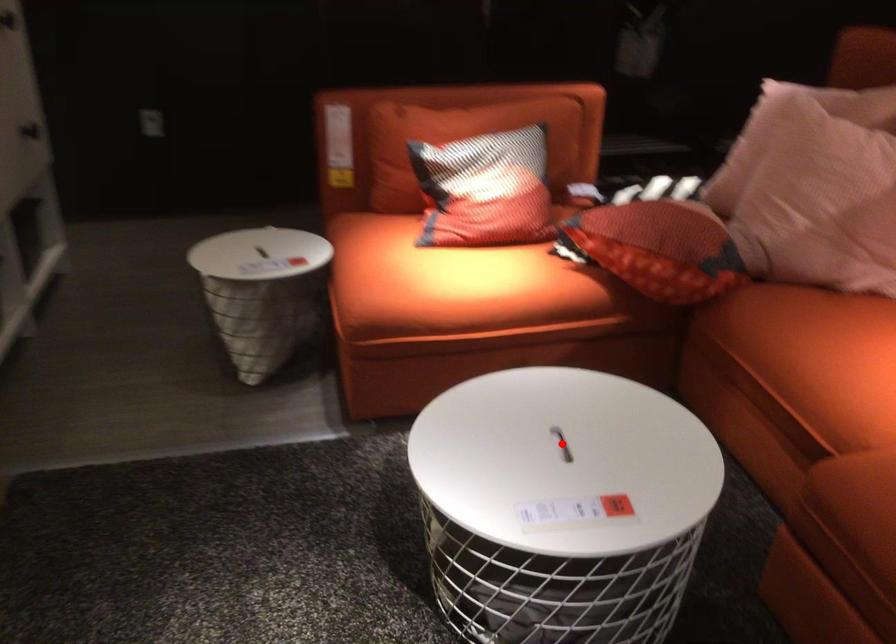
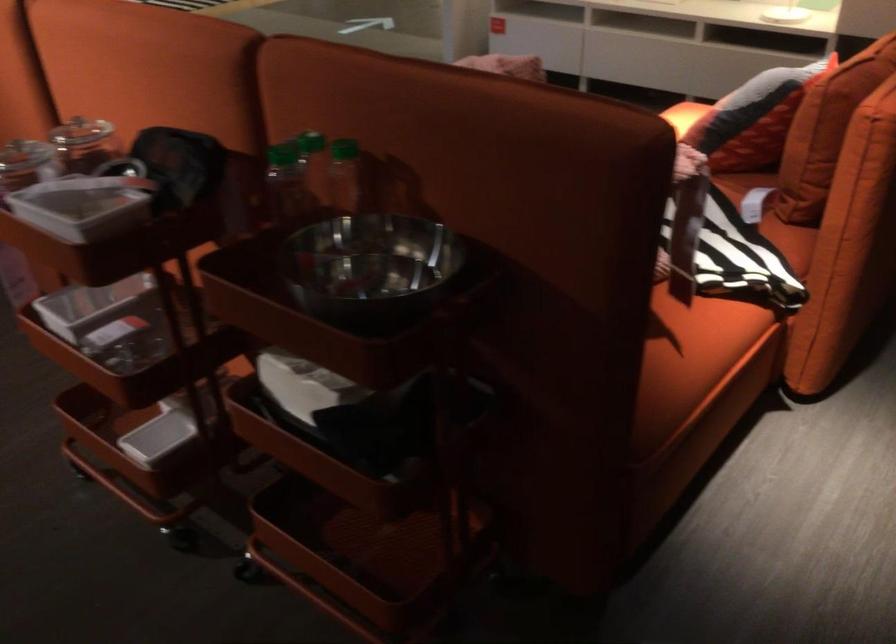
Question: I am providing you with two images of the same scene from different viewpoints. A red point is marked on the first image. At the location where the point appears in image 1, is it still visible in image 2?

Choices:
 (A) Yes
 (B) No

Answer: (B)